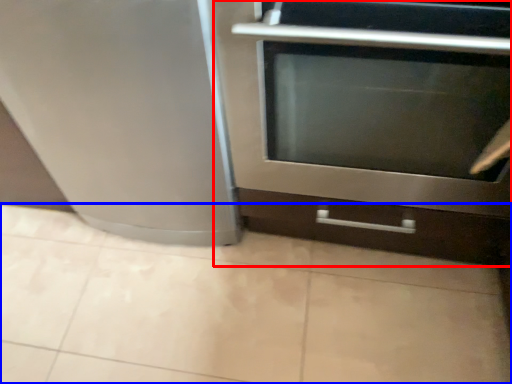
Question: Which object appears farthest to the camera in this image, oven (highlighted by a red box) or ceramic tile (highlighted by a blue box)?

Choices:
 (A) oven
 (B) ceramic tile

Answer: (B)